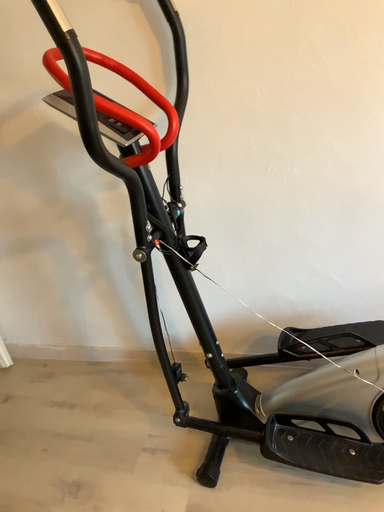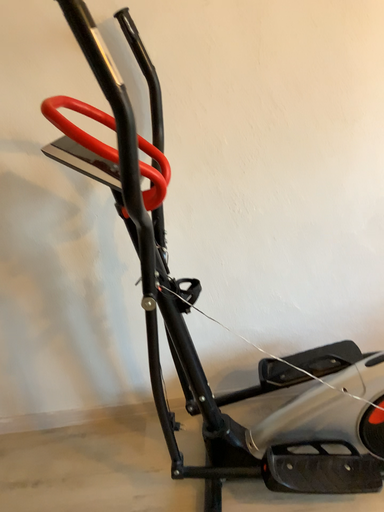
Question: How did the camera likely rotate when shooting the video?

Choices:
 (A) rotated downward
 (B) rotated upward

Answer: (B)